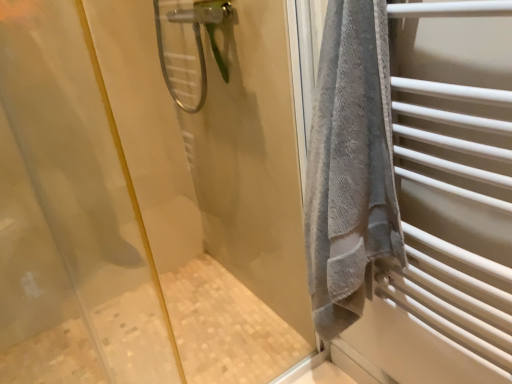
What do you see at coordinates (147, 200) in the screenshot? The image size is (512, 384). I see `transparent glass shower door at upper left` at bounding box center [147, 200].

In order to click on transparent glass shower door at upper left in this screenshot , I will do `click(147, 200)`.

The height and width of the screenshot is (384, 512). Find the location of `clear plastic shower head at upper center`. clear plastic shower head at upper center is located at coordinates (188, 47).

Describe the element at coordinates (188, 47) in the screenshot. I see `clear plastic shower head at upper center` at that location.

You are a GUI agent. You are given a task and a screenshot of the screen. Output one action in this format:
    pyautogui.click(x=<x>, y=<y>)
    Task: Click on the transparent glass shower door at upper left
    
    Given the screenshot: What is the action you would take?
    pyautogui.click(x=147, y=200)

Is transparent glass shower door at upper left at the left side of clear plastic shower head at upper center?

Incorrect, transparent glass shower door at upper left is not on the left side of clear plastic shower head at upper center.

Does transparent glass shower door at upper left come behind clear plastic shower head at upper center?

No.

Is point (276, 156) more distant than point (187, 69)?

No, it is in front of (187, 69).

From the image's perspective, which object appears higher, transparent glass shower door at upper left or clear plastic shower head at upper center?

clear plastic shower head at upper center is shown above in the image.

From a real-world perspective, is transparent glass shower door at upper left positioned under clear plastic shower head at upper center based on gravity?

Yes.

In terms of width, does transparent glass shower door at upper left look wider or thinner when compared to clear plastic shower head at upper center?

Clearly, transparent glass shower door at upper left has less width compared to clear plastic shower head at upper center.

Who is taller, transparent glass shower door at upper left or clear plastic shower head at upper center?

transparent glass shower door at upper left is taller.

Which of these two, transparent glass shower door at upper left or clear plastic shower head at upper center, is bigger?

Bigger between the two is transparent glass shower door at upper left.

Is clear plastic shower head at upper center a part of transparent glass shower door at upper left?

No, clear plastic shower head at upper center is located outside of transparent glass shower door at upper left.

Are transparent glass shower door at upper left and clear plastic shower head at upper center making contact?

transparent glass shower door at upper left is not next to clear plastic shower head at upper center, and they're not touching.

Is transparent glass shower door at upper left oriented towards clear plastic shower head at upper center?

No, transparent glass shower door at upper left is not aimed at clear plastic shower head at upper center.

You are a GUI agent. You are given a task and a screenshot of the screen. Output one action in this format:
    pyautogui.click(x=<x>, y=<y>)
    Task: Click on the shower located above the transparent glass shower door at upper left (from a real-world perspective)
    
    Given the screenshot: What is the action you would take?
    pyautogui.click(x=188, y=47)

Can you confirm if clear plastic shower head at upper center is positioned to the left of transparent glass shower door at upper left?

Yes, clear plastic shower head at upper center is to the left of transparent glass shower door at upper left.

Relative to transparent glass shower door at upper left, is clear plastic shower head at upper center in front or behind?

Visually, clear plastic shower head at upper center is located behind transparent glass shower door at upper left.

Does point (181, 38) come closer to viewer compared to point (101, 358)?

No, (181, 38) is further to viewer.

From the image's perspective, which one is positioned lower, clear plastic shower head at upper center or transparent glass shower door at upper left?

From the image's view, transparent glass shower door at upper left is below.

From a real-world perspective, is clear plastic shower head at upper center positioned above or below transparent glass shower door at upper left?

Clearly, from a real-world perspective, clear plastic shower head at upper center is above transparent glass shower door at upper left.

Can you confirm if clear plastic shower head at upper center is wider than transparent glass shower door at upper left?

Correct, the width of clear plastic shower head at upper center exceeds that of transparent glass shower door at upper left.

From the picture: Considering the sizes of objects clear plastic shower head at upper center and transparent glass shower door at upper left in the image provided, who is shorter, clear plastic shower head at upper center or transparent glass shower door at upper left?

clear plastic shower head at upper center is shorter.

Is clear plastic shower head at upper center bigger than transparent glass shower door at upper left?

No, clear plastic shower head at upper center is not bigger than transparent glass shower door at upper left.

Is clear plastic shower head at upper center situated inside transparent glass shower door at upper left or outside?

clear plastic shower head at upper center lies outside transparent glass shower door at upper left.

Is clear plastic shower head at upper center far from transparent glass shower door at upper left?

clear plastic shower head at upper center is actually quite close to transparent glass shower door at upper left.

Is clear plastic shower head at upper center positioned with its back to transparent glass shower door at upper left?

No, clear plastic shower head at upper center's orientation is not away from transparent glass shower door at upper left.

Can you tell me how much clear plastic shower head at upper center and transparent glass shower door at upper left differ in facing direction?

92.6 degrees.

Could you measure the distance between clear plastic shower head at upper center and transparent glass shower door at upper left?

The distance of clear plastic shower head at upper center from transparent glass shower door at upper left is 16.47 inches.

This screenshot has width=512, height=384. I want to click on screen door beneath the clear plastic shower head at upper center (from a real-world perspective), so click(147, 200).

The height and width of the screenshot is (384, 512). Find the location of `shower on the left of transparent glass shower door at upper left`. shower on the left of transparent glass shower door at upper left is located at coordinates (188, 47).

The width and height of the screenshot is (512, 384). What are the coordinates of `screen door that is under the clear plastic shower head at upper center (from a real-world perspective)` in the screenshot? It's located at (147, 200).